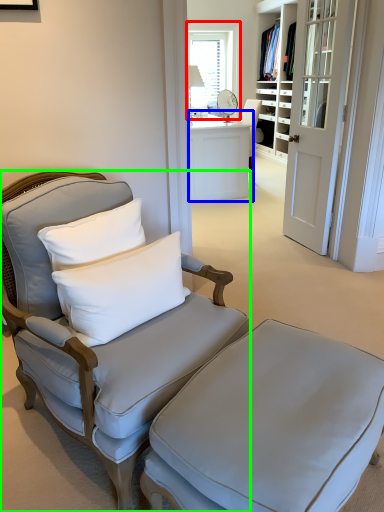
Question: Estimate the real-world distances between objects in this image. Which object is closer to window (highlighted by a red box), desk (highlighted by a blue box) or chair (highlighted by a green box)?

Choices:
 (A) desk
 (B) chair

Answer: (A)